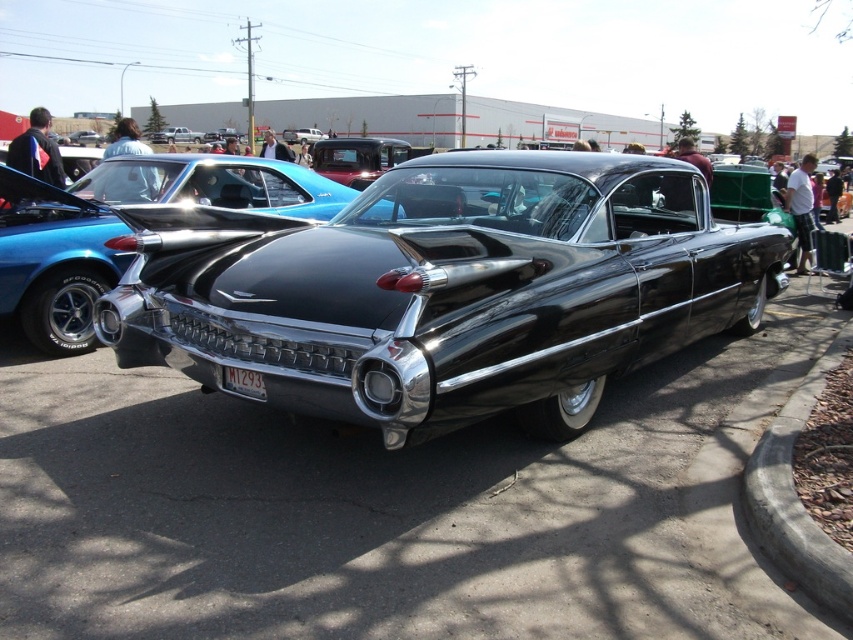
Can you confirm if glossy black car at center is thinner than white plastic license plate at center?

No.

Can you confirm if glossy black car at center is shorter than white plastic license plate at center?

In fact, glossy black car at center may be taller than white plastic license plate at center.

The height and width of the screenshot is (640, 853). Describe the element at coordinates (445, 289) in the screenshot. I see `glossy black car at center` at that location.

This screenshot has height=640, width=853. I want to click on glossy black car at center, so click(x=445, y=289).

In the scene shown: Who is higher up, shiny black car at center or white plastic license plate at center?

shiny black car at center is above.

Which is behind, point (38, 244) or point (229, 369)?

The point (38, 244) is more distant.

Between point (137, 180) and point (241, 372), which one is positioned in front?

Positioned in front is point (241, 372).

Identify the location of shiny black car at center. The width and height of the screenshot is (853, 640). (125, 228).

The image size is (853, 640). I want to click on glossy black car at center, so click(445, 289).

Is point (136, 298) farther from viewer compared to point (178, 163)?

No, it is not.

The height and width of the screenshot is (640, 853). In order to click on glossy black car at center in this screenshot , I will do `click(445, 289)`.